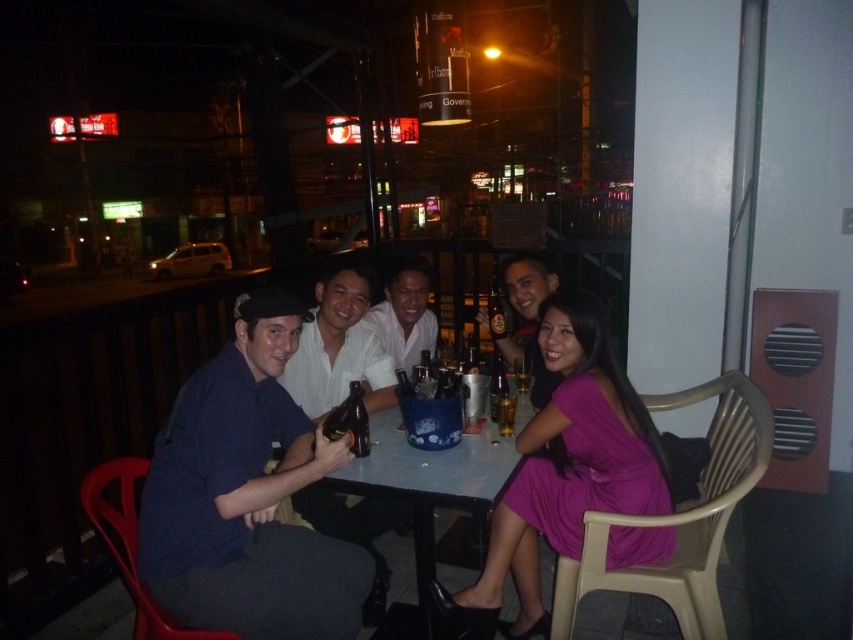
In the scene shown: Is pink satin dress at center below dark blue shirt at center?

Indeed, pink satin dress at center is positioned under dark blue shirt at center.

Which is in front, point (581, 362) or point (337, 348)?

Point (581, 362)

Where is `pink satin dress at center`? This screenshot has width=853, height=640. pink satin dress at center is located at coordinates (563, 470).

Is dark blue shirt at center above translucent plastic bottle at center?

Correct, dark blue shirt at center is located above translucent plastic bottle at center.

Between dark blue shirt at center and translucent plastic bottle at center, which one has more height?

Standing taller between the two is dark blue shirt at center.

Between point (309, 369) and point (498, 371), which one is positioned behind?

Point (309, 369)

This screenshot has width=853, height=640. Identify the location of dark blue shirt at center. (340, 346).

Describe the element at coordinates (563, 470) in the screenshot. I see `pink satin dress at center` at that location.

Between pink satin dress at center and brown glass bottle at table center, which one has more height?

pink satin dress at center is taller.

This screenshot has height=640, width=853. In order to click on pink satin dress at center in this screenshot , I will do `click(563, 470)`.

The height and width of the screenshot is (640, 853). I want to click on pink satin dress at center, so click(563, 470).